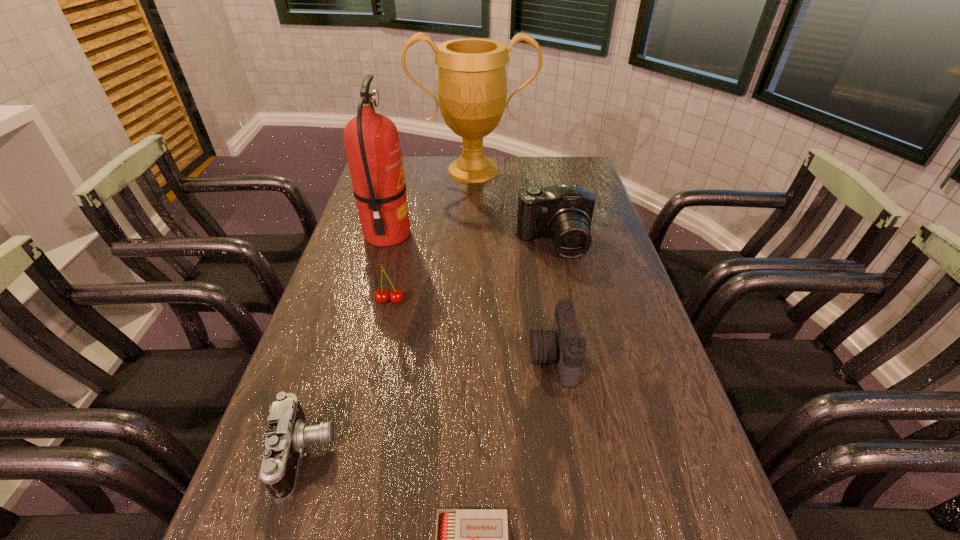
Where is `blank space located on the side of the fire extinguisher with the nozzle and handle`? The width and height of the screenshot is (960, 540). blank space located on the side of the fire extinguisher with the nozzle and handle is located at coordinates (463, 235).

Find the location of a particular element. This screenshot has height=540, width=960. free location located 0.150m on the lens of the third tallest object is located at coordinates (565, 298).

I want to click on vacant space situated 0.310m at the lens of the second nearest camera, so click(x=394, y=357).

You are a GUI agent. You are given a task and a screenshot of the screen. Output one action in this format:
    pyautogui.click(x=<x>, y=<y>)
    Task: Click on the vacant region located at the lens of the second nearest camera
    The width and height of the screenshot is (960, 540).
    Given the screenshot: What is the action you would take?
    pyautogui.click(x=482, y=357)

What are the coordinates of `free point located at the lens of the second nearest camera` in the screenshot? It's located at (359, 357).

The width and height of the screenshot is (960, 540). I want to click on blank area located 0.290m with the stems of the cherry pointing upwards, so click(368, 406).

Where is `vacant area situated 0.290m at the lens of the sixth farthest object`? Image resolution: width=960 pixels, height=540 pixels. vacant area situated 0.290m at the lens of the sixth farthest object is located at coordinates (490, 454).

Identify the location of object that is at the far edge. This screenshot has height=540, width=960. click(x=472, y=88).

At what (x,y) coordinates should I click in order to perform the action: click on trophy that is positioned at the left edge. Please return your answer as a coordinate pair (x, y). Image resolution: width=960 pixels, height=540 pixels. Looking at the image, I should click on (472, 88).

Locate an element on the screen. fire extinguisher present at the left edge is located at coordinates (372, 144).